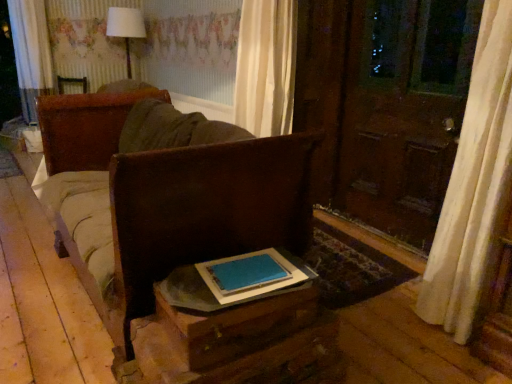
Locate an element on the screen. vacant point above wooden table at lower center (from a real-world perspective) is located at coordinates (250, 275).